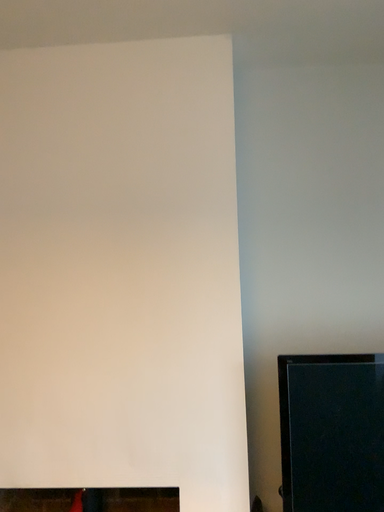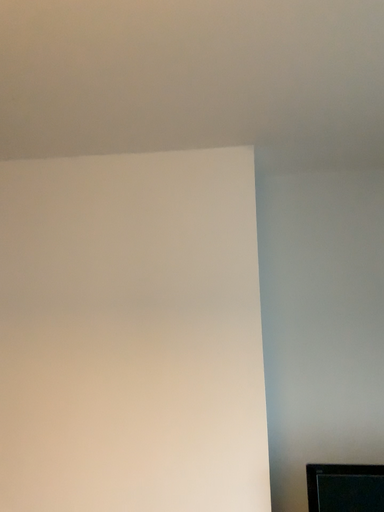
Question: How did the camera likely rotate when shooting the video?

Choices:
 (A) rotated downward
 (B) rotated upward

Answer: (B)